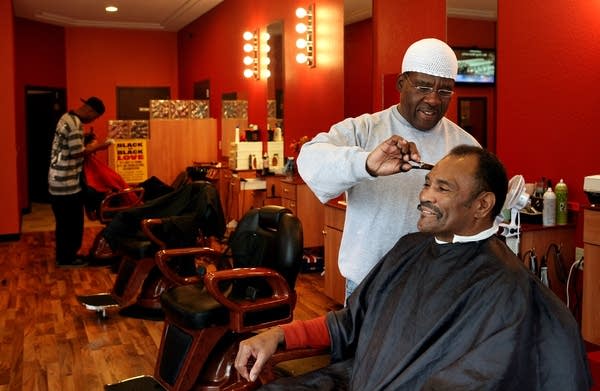
What are the coordinates of `wall` in the screenshot? It's located at (530, 104).